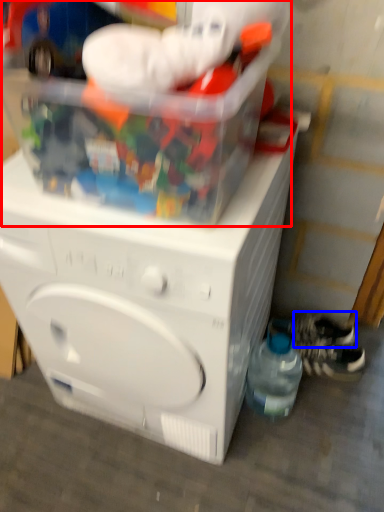
Question: Which object appears closest to the camera in this image, toy (highlighted by a red box) or shoe (highlighted by a blue box)?

Choices:
 (A) toy
 (B) shoe

Answer: (A)